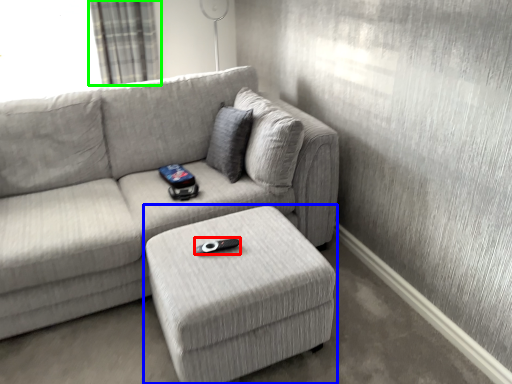
Question: Which object is the farthest from remote (highlighted by a red box)? Choose among these: table (highlighted by a blue box) or curtain (highlighted by a green box).

Choices:
 (A) table
 (B) curtain

Answer: (B)